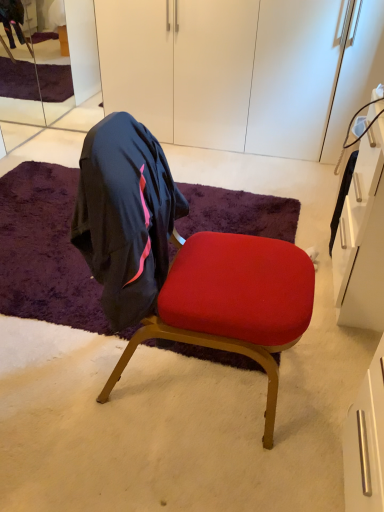
What do you see at coordinates (241, 71) in the screenshot? The height and width of the screenshot is (512, 384). I see `white matte cabinet at upper center` at bounding box center [241, 71].

Where is `clear glass mirror at upper left`? Image resolution: width=384 pixels, height=512 pixels. clear glass mirror at upper left is located at coordinates (33, 74).

The image size is (384, 512). Describe the element at coordinates (181, 261) in the screenshot. I see `velvet red chair at center` at that location.

This screenshot has height=512, width=384. I want to click on white matte cabinet at upper center, so click(x=241, y=71).

From a real-world perspective, who is located higher, white matte cabinet at upper center or clear glass mirror at upper left?

In real-world perspective, white matte cabinet at upper center is above.

The width and height of the screenshot is (384, 512). What are the coordinates of `mirror behind the white matte cabinet at upper center` in the screenshot? It's located at tap(33, 74).

Is white matte cabinet at upper center not within clear glass mirror at upper left?

Yes, white matte cabinet at upper center is not within clear glass mirror at upper left.

Is velvet red chair at center facing towards clear glass mirror at upper left?

No, velvet red chair at center is not oriented towards clear glass mirror at upper left.

Based on the photo, from the image's perspective, which is below, velvet red chair at center or clear glass mirror at upper left?

velvet red chair at center.

Does velvet red chair at center have a greater width compared to clear glass mirror at upper left?

Yes.

Between velvet red chair at center and clear glass mirror at upper left, which one has larger size?

velvet red chair at center is bigger.

From a real-world perspective, is clear glass mirror at upper left on white matte cabinet at upper center?

Actually, clear glass mirror at upper left is physically below white matte cabinet at upper center in the real world.

How different are the orientations of clear glass mirror at upper left and white matte cabinet at upper center in degrees?

There is a 89.8-degree angle between the facing directions of clear glass mirror at upper left and white matte cabinet at upper center.

In the scene shown: Is clear glass mirror at upper left facing away from white matte cabinet at upper center?

No, clear glass mirror at upper left is not facing away from white matte cabinet at upper center.

Identify the location of chair in front of the purple shaggy rug at center. The width and height of the screenshot is (384, 512). (181, 261).

Can you tell me how much velvet red chair at center and purple shaggy rug at center differ in facing direction?

The angular difference between velvet red chair at center and purple shaggy rug at center is 92 degrees.

From a real-world perspective, is velvet red chair at center located higher than purple shaggy rug at center?

Yes, from a real-world perspective, velvet red chair at center is over purple shaggy rug at center

Which object is positioned more to the right, velvet red chair at center or purple shaggy rug at center?

velvet red chair at center is more to the right.

Does point (320, 118) appear closer or farther from the camera than point (123, 294)?

Clearly, point (320, 118) is more distant from the camera than point (123, 294).

Considering the relative sizes of white matte cabinet at upper center and velvet red chair at center in the image provided, is white matte cabinet at upper center taller than velvet red chair at center?

Indeed, white matte cabinet at upper center has a greater height compared to velvet red chair at center.

From the image's perspective, who appears lower, white matte cabinet at upper center or velvet red chair at center?

velvet red chair at center.

Between velvet red chair at center and white matte cabinet at upper center, which one has larger size?

white matte cabinet at upper center.

Considering the sizes of objects velvet red chair at center and white matte cabinet at upper center in the image provided, who is shorter, velvet red chair at center or white matte cabinet at upper center?

Standing shorter between the two is velvet red chair at center.

Which is in front, point (273, 301) or point (313, 8)?

The point (273, 301) is in front.

At what (x,y) coordinates should I click in order to perform the action: click on chair in front of the purple shaggy rug at center. Please return your answer as a coordinate pair (x, y). The height and width of the screenshot is (512, 384). Looking at the image, I should click on (181, 261).

Would you say velvet red chair at center is part of purple shaggy rug at center's contents?

That's incorrect, velvet red chair at center is not inside purple shaggy rug at center.

Is purple shaggy rug at center smaller than velvet red chair at center?

Yes.

In the image, is purple shaggy rug at center on the left side or the right side of velvet red chair at center?

purple shaggy rug at center is to the left of velvet red chair at center.

Where is `cabinetry above the clear glass mirror at upper left (from a real-world perspective)`? cabinetry above the clear glass mirror at upper left (from a real-world perspective) is located at coordinates (241, 71).

This screenshot has width=384, height=512. What are the coordinates of `mirror behind the velvet red chair at center` in the screenshot? It's located at (33, 74).

Based on the photo, estimate the real-world distances between objects in this image. Which object is further from clear glass mirror at upper left, velvet red chair at center or white matte cabinet at upper center?

The object further to clear glass mirror at upper left is velvet red chair at center.

Based on their spatial positions, is purple shaggy rug at center or white matte cabinet at upper center further from clear glass mirror at upper left?

The object further to clear glass mirror at upper left is white matte cabinet at upper center.

Which object lies nearer to the anchor point velvet red chair at center, purple shaggy rug at center or clear glass mirror at upper left?

purple shaggy rug at center.

When comparing their distances from purple shaggy rug at center, does velvet red chair at center or white matte cabinet at upper center seem closer?

velvet red chair at center is closer to purple shaggy rug at center.

Based on their spatial positions, is white matte cabinet at upper center or purple shaggy rug at center closer to velvet red chair at center?

Among the two, purple shaggy rug at center is located nearer to velvet red chair at center.

Estimate the real-world distances between objects in this image. Which object is closer to velvet red chair at center, white matte cabinet at upper center or clear glass mirror at upper left?

Among the two, white matte cabinet at upper center is located nearer to velvet red chair at center.

Based on their spatial positions, is velvet red chair at center or clear glass mirror at upper left further from purple shaggy rug at center?

Based on the image, clear glass mirror at upper left appears to be further to purple shaggy rug at center.

When comparing their distances from clear glass mirror at upper left, does white matte cabinet at upper center or velvet red chair at center seem further?

velvet red chair at center.

Image resolution: width=384 pixels, height=512 pixels. I want to click on mat situated between clear glass mirror at upper left and white matte cabinet at upper center from left to right, so click(44, 250).

You are a GUI agent. You are given a task and a screenshot of the screen. Output one action in this format:
    pyautogui.click(x=<x>, y=<y>)
    Task: Click on the mat that lies between white matte cabinet at upper center and velvet red chair at center from top to bottom
    This screenshot has height=512, width=384.
    Given the screenshot: What is the action you would take?
    pyautogui.click(x=44, y=250)

You are a GUI agent. You are given a task and a screenshot of the screen. Output one action in this format:
    pyautogui.click(x=<x>, y=<y>)
    Task: Click on the mat between velvet red chair at center and clear glass mirror at upper left from front to back
    The image size is (384, 512).
    Given the screenshot: What is the action you would take?
    pyautogui.click(x=44, y=250)

The width and height of the screenshot is (384, 512). I want to click on cabinetry between velvet red chair at center and clear glass mirror at upper left along the z-axis, so click(x=241, y=71).